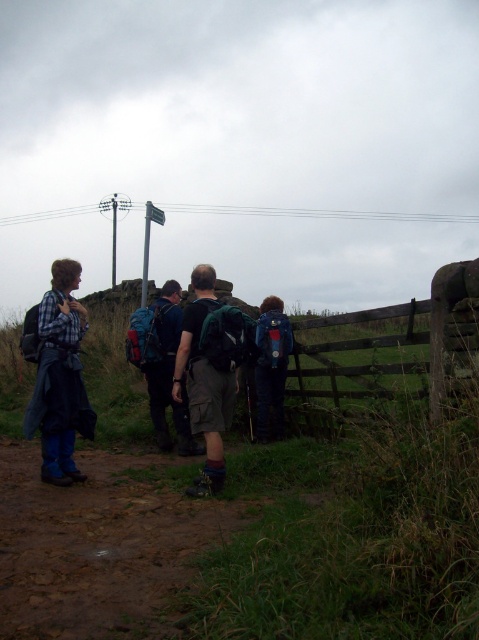
Question: Does green canvas backpack at center lie behind green fabric backpack at center?

Choices:
 (A) yes
 (B) no

Answer: (B)

Question: Does green canvas backpack at center have a greater width compared to green fabric backpack at center?

Choices:
 (A) yes
 (B) no

Answer: (B)

Question: Which object appears closest to the camera in this image?

Choices:
 (A) green fabric backpack at center
 (B) green canvas backpack at center

Answer: (B)

Question: Is green canvas backpack at center to the right of green fabric backpack at center from the viewer's perspective?

Choices:
 (A) no
 (B) yes

Answer: (B)

Question: Which object appears closest to the camera in this image?

Choices:
 (A) green canvas backpack at center
 (B) green fabric backpack at center

Answer: (A)